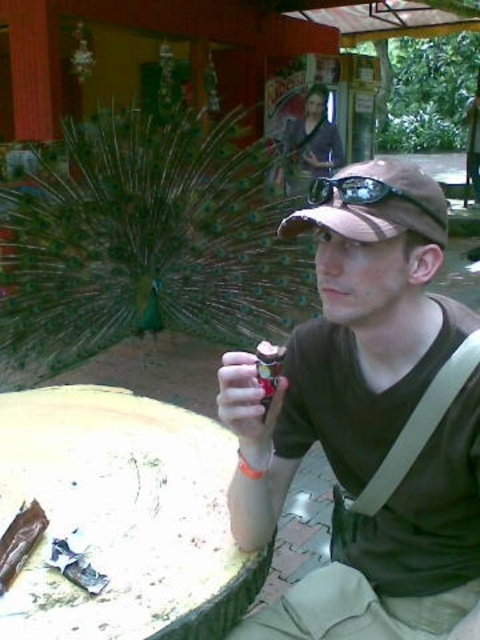
Question: Which point appears farthest from the camera in this image?

Choices:
 (A) (382, 193)
 (B) (409, 611)

Answer: (B)

Question: Observing the image, what is the correct spatial positioning of matte brown shirt at center in reference to black rubber goggles at center?

Choices:
 (A) left
 (B) right

Answer: (A)

Question: Is matte brown shirt at center smaller than black rubber goggles at center?

Choices:
 (A) no
 (B) yes

Answer: (A)

Question: Which point appears farthest from the camera in this image?

Choices:
 (A) (421, 557)
 (B) (374, 182)

Answer: (A)

Question: Can you confirm if matte brown shirt at center is positioned to the left of black rubber goggles at center?

Choices:
 (A) no
 (B) yes

Answer: (B)